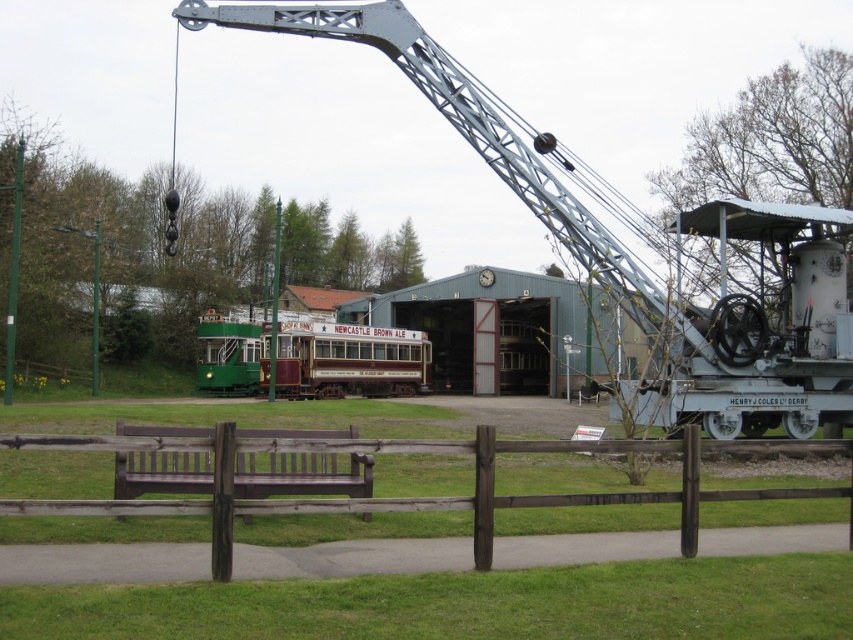
Question: Which point is farther from the camera taking this photo?

Choices:
 (A) (241, 480)
 (B) (851, 477)
 (C) (375, 346)
 (D) (527, 148)

Answer: (C)

Question: Estimate the real-world distances between objects in this image. Which object is farther from the green polished wood tram at center?

Choices:
 (A) brown wooden fence at lower center
 (B) metallic gray crane at center

Answer: (A)

Question: Is brown wooden fence at lower center bigger than green polished wood tram at center?

Choices:
 (A) yes
 (B) no

Answer: (B)

Question: Does brown wooden fence at lower center appear over green polished wood tram at center?

Choices:
 (A) yes
 (B) no

Answer: (A)

Question: Estimate the real-world distances between objects in this image. Which object is farther from the brown wooden bench at center?

Choices:
 (A) brown wooden fence at lower center
 (B) green polished wood tram at center
 (C) metallic gray crane at center

Answer: (B)

Question: Is metallic gray crane at center behind brown wooden bench at center?

Choices:
 (A) no
 (B) yes

Answer: (B)